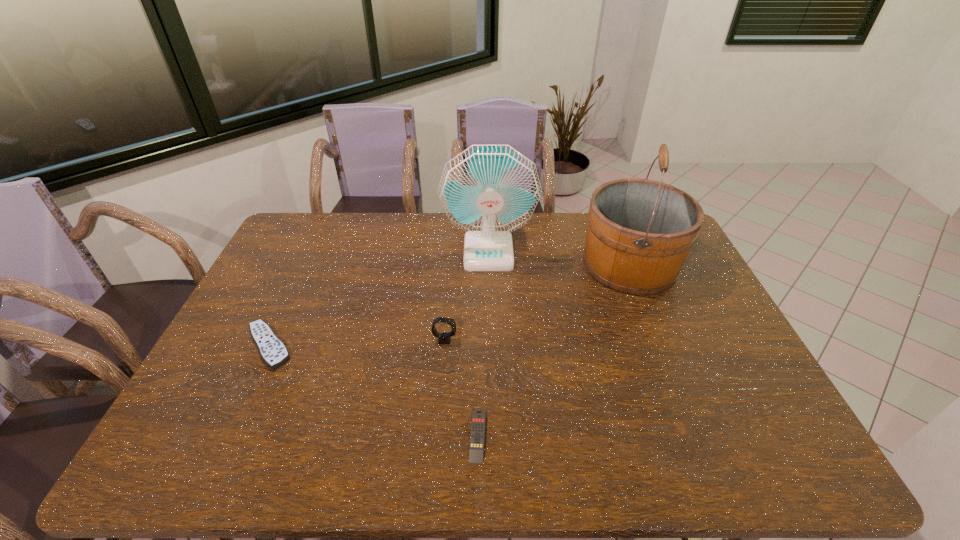
I want to click on free space located 0.150m on the back of the fourth tallest object, so click(295, 289).

The image size is (960, 540). What are the coordinates of `free space located 0.320m on the left of the right remote control` in the screenshot? It's located at (333, 435).

Find the location of a particular element. The height and width of the screenshot is (540, 960). fan that is at the far edge is located at coordinates (489, 191).

Find the location of a particular element. bucket located in the far edge section of the desktop is located at coordinates (640, 231).

This screenshot has height=540, width=960. What are the coordinates of `object at the near edge` in the screenshot? It's located at (476, 450).

Identify the location of object situated at the left edge. (273, 351).

Identify the location of object that is at the right edge. This screenshot has width=960, height=540. (640, 231).

Find the location of `object situated at the far right corner`. object situated at the far right corner is located at coordinates (640, 231).

Where is `vacant space at the far edge`? vacant space at the far edge is located at coordinates (544, 215).

At what (x,y) coordinates should I click in order to perform the action: click on vacant space at the near edge of the desktop. Please return your answer as a coordinate pair (x, y). Looking at the image, I should click on coord(463,467).